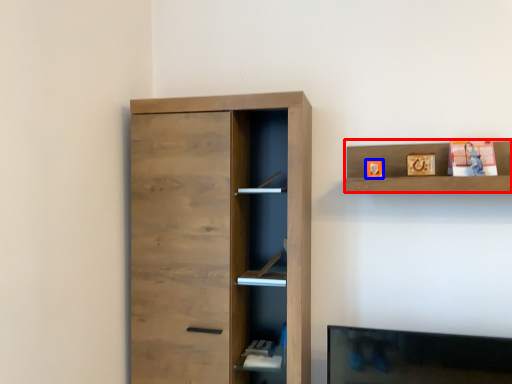
Question: Which of the following is the farthest to the observer, shelf (highlighted by a red box) or toy (highlighted by a blue box)?

Choices:
 (A) shelf
 (B) toy

Answer: (B)